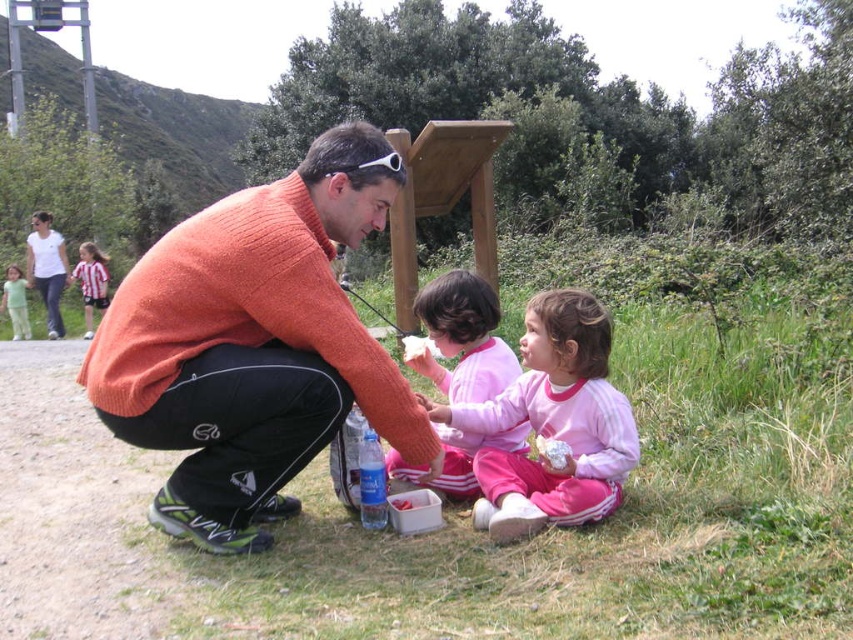
You are planning to place a new item in the picnic basket. The item is as wide as the orange sweater at center. Will it fit inside the white plastic bag at lower center?

The orange sweater at center is wider than the white plastic bag at lower center, so the item will not fit inside the white plastic bag at lower center.

You are a photographer taking a picture of the scene. You need to focus on both the pink fleece jacket at lower center and the light green fabric pants at lower left. Which object should you focus on first to ensure both are in focus?

You should focus on the pink fleece jacket at lower center first because it is closer to the viewer than the light green fabric pants at lower left, so adjusting focus from near to far will help both be in focus.